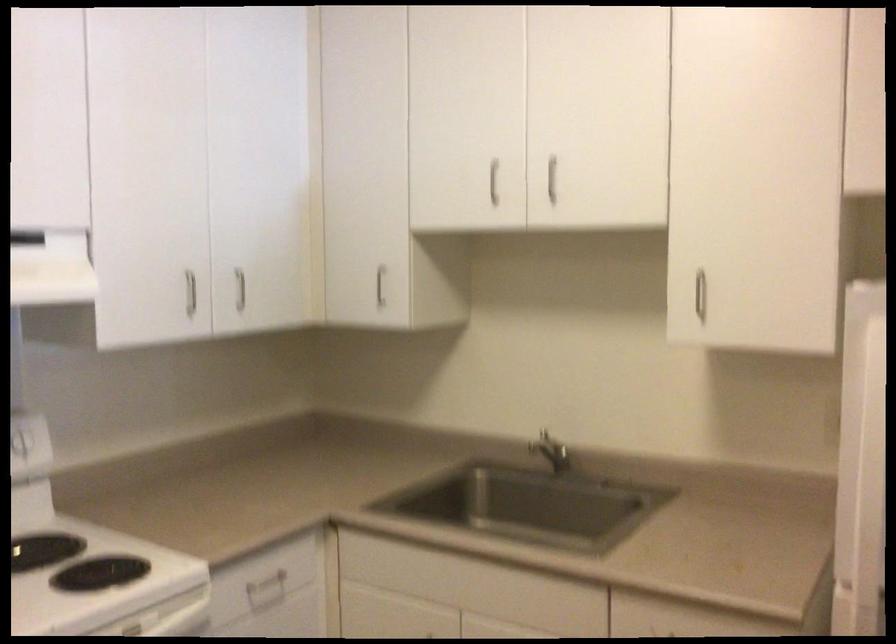
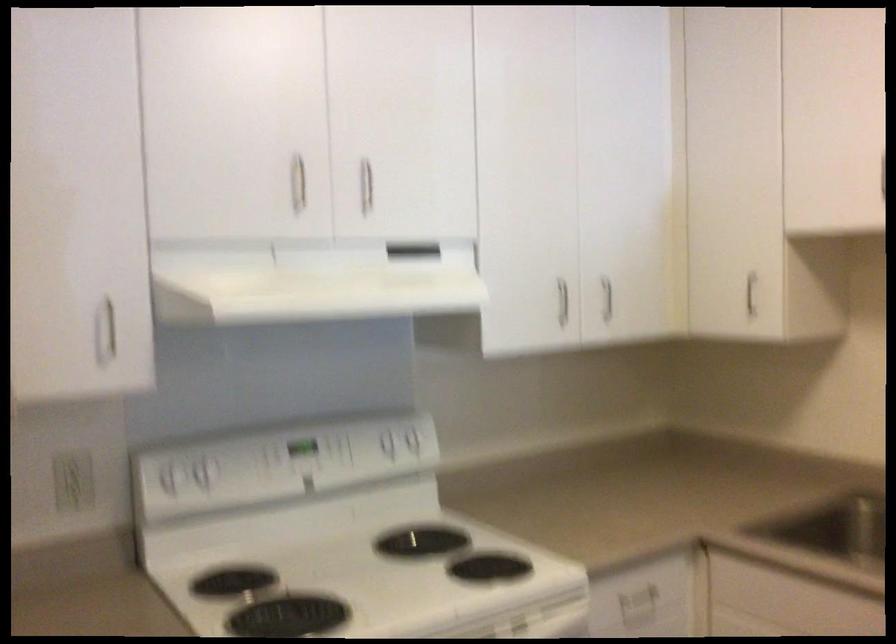
Find the pixel in the second image that matches pixel 237 283 in the first image.

(607, 298)